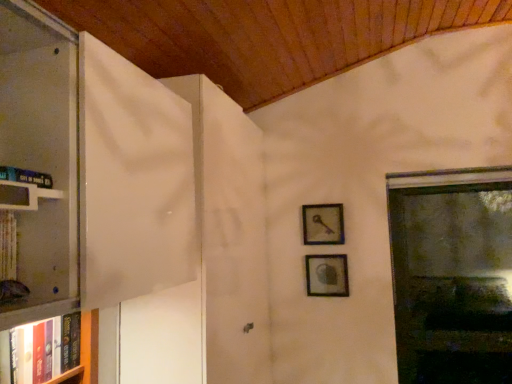
Question: Looking at their shapes, would you say white glossy bookshelf at left is wider or thinner than matte silver picture frame at center-right, which appears as the second picture frame when viewed from the top?

Choices:
 (A) thin
 (B) wide

Answer: (A)

Question: From a real-world perspective, is white glossy bookshelf at left positioned above or below matte silver picture frame at center-right, which appears as the second picture frame when viewed from the top?

Choices:
 (A) below
 (B) above

Answer: (B)

Question: Which object is the closest to the white glossy bookshelf at left?

Choices:
 (A) transparent glass window at right
 (B) metallic key at upper right, which is the first picture frame from top to bottom
 (C) hardcover book at left, arranged as the second book when ordered from the bottom
 (D) hardcover book at left, marked as the second book in a top-to-bottom arrangement
 (E) matte silver picture frame at center-right, which appears as the second picture frame when viewed from the top

Answer: (C)

Question: Which of these objects is positioned farthest from the white glossy bookshelf at left?

Choices:
 (A) transparent glass window at right
 (B) matte silver picture frame at center-right, which appears as the second picture frame when viewed from the top
 (C) hardcover book at left, the 1th book positioned from the top
 (D) metallic key at upper right, which is the first picture frame from top to bottom
 (E) hardcover book at left, positioned as the 1th book in bottom-to-top order

Answer: (A)